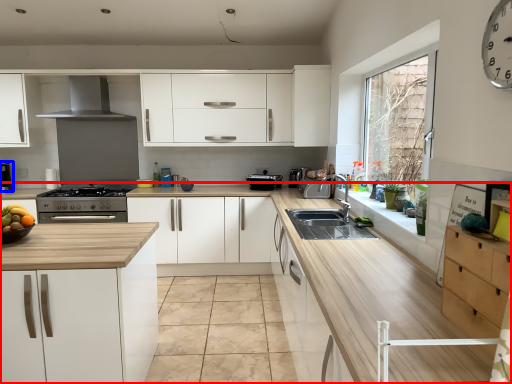
Question: Which of the following is the farthest to the observer, countertop (highlighted by a red box) or coffee machine (highlighted by a blue box)?

Choices:
 (A) countertop
 (B) coffee machine

Answer: (B)